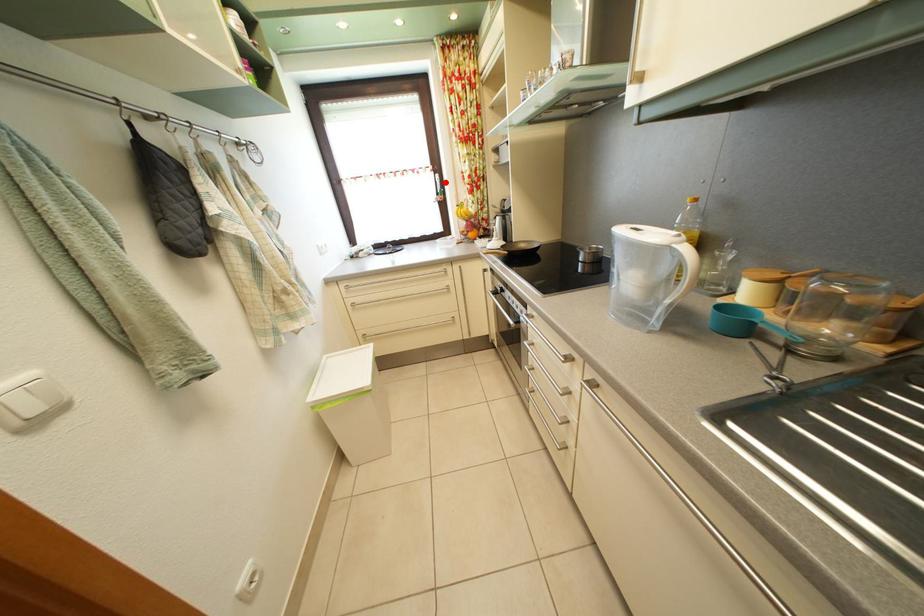
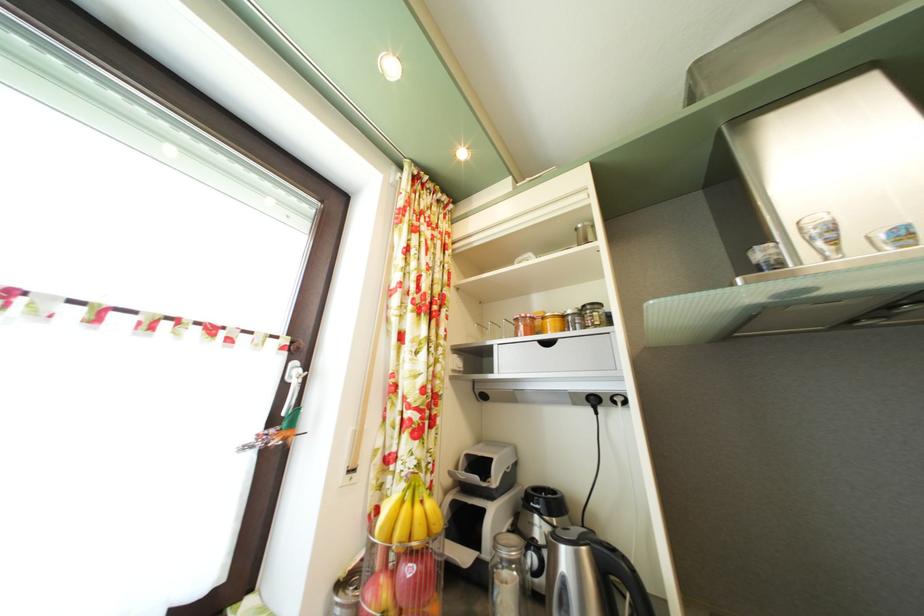
In the second image, find the point that corresponds to the highlighted location in the first image.

(304, 371)